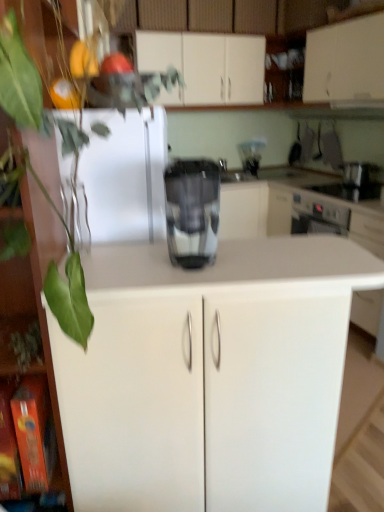
Question: From a real-world perspective, is metallic silver coffee maker at center positioned under metallic silver toaster at upper right, the 1th appliance in the top-to-bottom sequence, based on gravity?

Choices:
 (A) no
 (B) yes

Answer: (A)

Question: Is metallic silver coffee maker at center taller than metallic silver toaster at upper right, the 1th appliance in the top-to-bottom sequence?

Choices:
 (A) yes
 (B) no

Answer: (A)

Question: Considering the relative sizes of metallic silver coffee maker at center and metallic silver toaster at upper right, marked as the 2th appliance in a bottom-to-top arrangement, in the image provided, is metallic silver coffee maker at center shorter than metallic silver toaster at upper right, marked as the 2th appliance in a bottom-to-top arrangement,?

Choices:
 (A) no
 (B) yes

Answer: (A)

Question: Can you confirm if metallic silver coffee maker at center is positioned to the left of metallic silver toaster at upper right, marked as the 2th appliance in a bottom-to-top arrangement?

Choices:
 (A) no
 (B) yes

Answer: (B)

Question: Is metallic silver coffee maker at center facing towards metallic silver toaster at upper right, marked as the 2th appliance in a bottom-to-top arrangement?

Choices:
 (A) no
 (B) yes

Answer: (B)

Question: In terms of height, does sleek metallic coffee maker at center look taller or shorter compared to green leafy plant at left?

Choices:
 (A) short
 (B) tall

Answer: (A)

Question: Is sleek metallic coffee maker at center wider or thinner than green leafy plant at left?

Choices:
 (A) wide
 (B) thin

Answer: (B)

Question: From a real-world perspective, relative to green leafy plant at left, is sleek metallic coffee maker at center vertically above or below?

Choices:
 (A) above
 (B) below

Answer: (B)

Question: Does point [x=178, y=197] appear closer or farther from the camera than point [x=79, y=121]?

Choices:
 (A) farther
 (B) closer

Answer: (B)

Question: Choose the correct answer: Is metallic silver toaster at upper right, marked as the 2th appliance in a bottom-to-top arrangement, inside white matte cabinet at upper center, which is counted as the second cabinetry, starting from the back, or outside it?

Choices:
 (A) inside
 (B) outside

Answer: (B)

Question: Considering the positions of metallic silver toaster at upper right, the 1th appliance in the top-to-bottom sequence, and white matte cabinet at upper center, which is the 3th cabinetry in front-to-back order, in the image, is metallic silver toaster at upper right, the 1th appliance in the top-to-bottom sequence, wider or thinner than white matte cabinet at upper center, which is the 3th cabinetry in front-to-back order,?

Choices:
 (A) thin
 (B) wide

Answer: (A)

Question: Considering the relative positions of metallic silver toaster at upper right, the 1th appliance in the top-to-bottom sequence, and white matte cabinet at upper center, which is counted as the second cabinetry, starting from the back, in the image provided, is metallic silver toaster at upper right, the 1th appliance in the top-to-bottom sequence, to the left or to the right of white matte cabinet at upper center, which is counted as the second cabinetry, starting from the back,?

Choices:
 (A) left
 (B) right

Answer: (B)

Question: From a real-world perspective, is metallic silver toaster at upper right, the 1th appliance in the top-to-bottom sequence, physically located above or below white matte cabinet at upper center, which is counted as the second cabinetry, starting from the back?

Choices:
 (A) above
 (B) below

Answer: (B)

Question: From a real-world perspective, relative to black glass stove at upper right, the 2th appliance when ordered from top to bottom, is metallic silver toaster at upper right, marked as the 2th appliance in a bottom-to-top arrangement, vertically above or below?

Choices:
 (A) below
 (B) above

Answer: (B)

Question: Is metallic silver toaster at upper right, the 1th appliance in the top-to-bottom sequence, to the left or to the right of black glass stove at upper right, the first appliance from the bottom, in the image?

Choices:
 (A) right
 (B) left

Answer: (A)